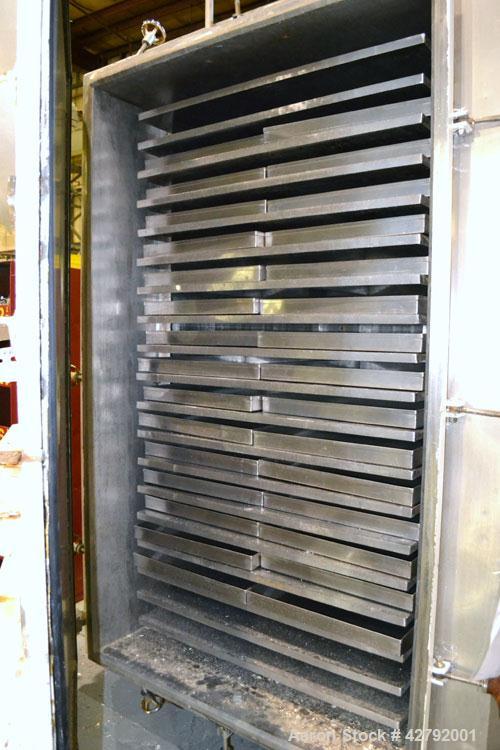
Identify the location of floor. (89, 684), (87, 716).